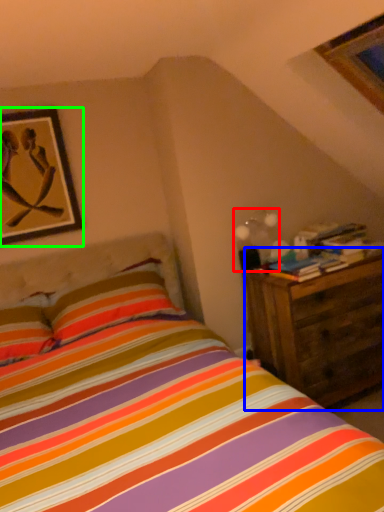
Question: Which object is positioned closest to light fixture (highlighted by a red box)? Select from nightstand (highlighted by a blue box) and picture frame (highlighted by a green box).

Choices:
 (A) nightstand
 (B) picture frame

Answer: (A)